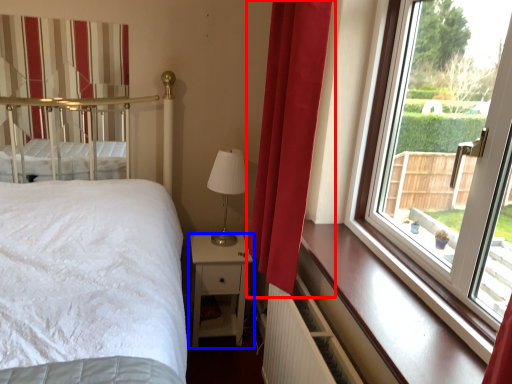
Question: Which object appears farthest to the camera in this image, curtain (highlighted by a red box) or nightstand (highlighted by a blue box)?

Choices:
 (A) curtain
 (B) nightstand

Answer: (B)